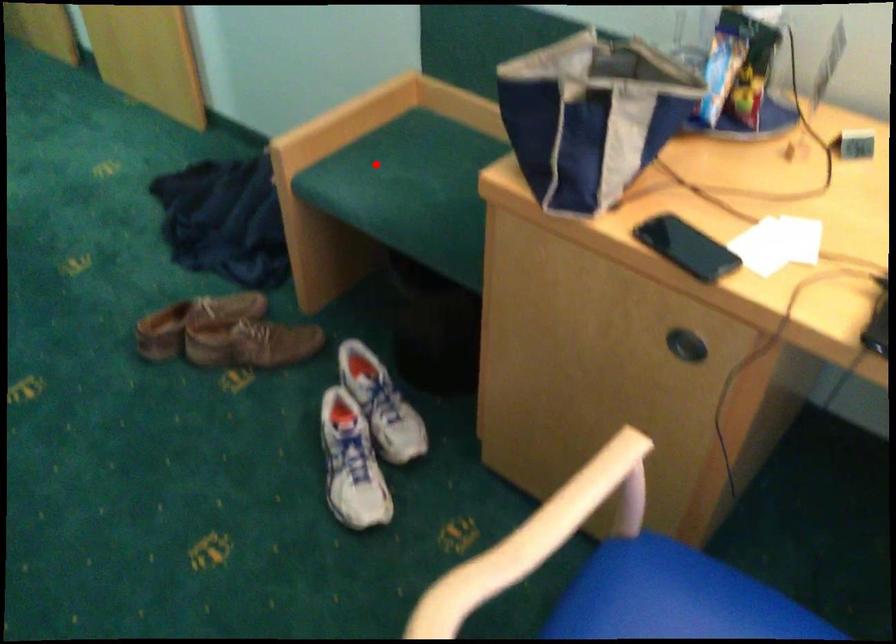
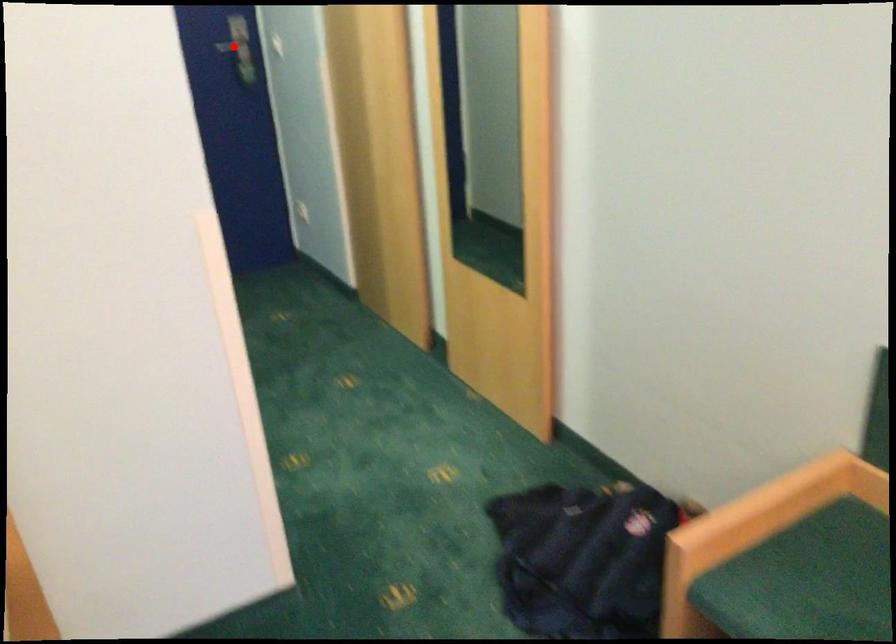
From the picture: I am providing you with two images of the same scene from different viewpoints. A red point is marked on the first image and another point is marked on the second image. Is the marked point in image1 the same physical position as the marked point in image2?

No